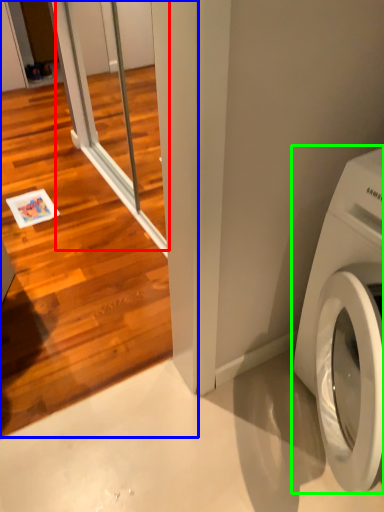
Question: Estimate the real-world distances between objects in this image. Which object is closer to screen door (highlighted by a red box), screen door (highlighted by a blue box) or washing machine (highlighted by a green box)?

Choices:
 (A) screen door
 (B) washing machine

Answer: (A)